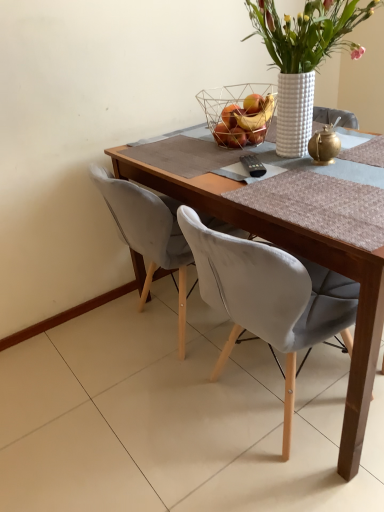
The width and height of the screenshot is (384, 512). In order to click on vacant area in front of wire mesh basket at upper center in this screenshot , I will do `click(240, 159)`.